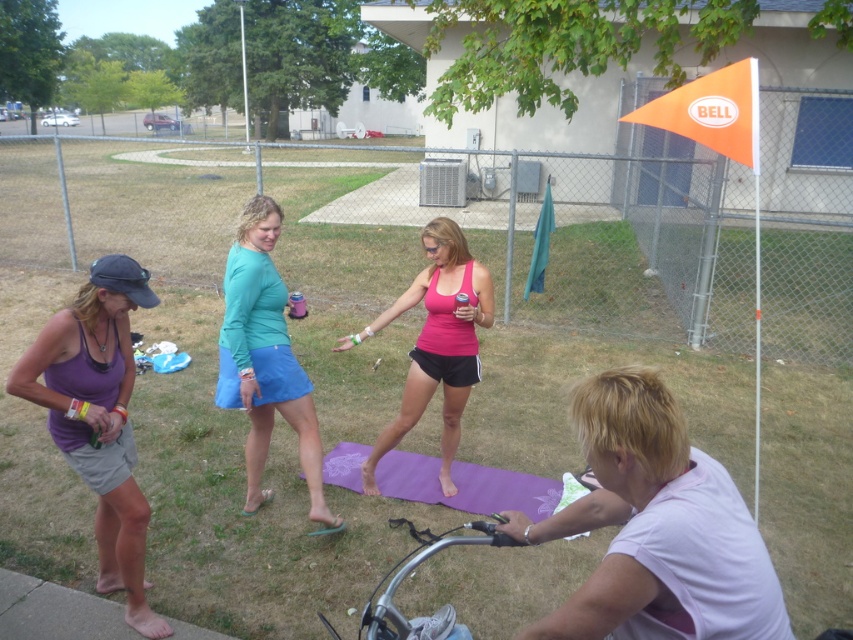
Does purple matte tank top at left appear on the right side of teal fabric skirt at center?

In fact, purple matte tank top at left is to the left of teal fabric skirt at center.

Between point (44, 356) and point (310, 429), which one is positioned behind?

Point (310, 429)

Where is `purple matte tank top at left`? Image resolution: width=853 pixels, height=640 pixels. purple matte tank top at left is located at coordinates (97, 417).

Can you confirm if pink matte tank top at center is thinner than purple yoga mat at center?

Yes.

Does pink matte tank top at center lie in front of purple yoga mat at center?

That is True.

Locate an element on the screen. Image resolution: width=853 pixels, height=640 pixels. pink matte tank top at center is located at coordinates (434, 342).

Find the location of a particular element. Image resolution: width=853 pixels, height=640 pixels. pink matte tank top at center is located at coordinates (434, 342).

Is teal fabric skirt at center closer to the viewer compared to pink matte tank top at center?

Yes, teal fabric skirt at center is in front of pink matte tank top at center.

Who is taller, teal fabric skirt at center or pink matte tank top at center?

teal fabric skirt at center is taller.

Image resolution: width=853 pixels, height=640 pixels. In order to click on teal fabric skirt at center in this screenshot , I will do `click(265, 358)`.